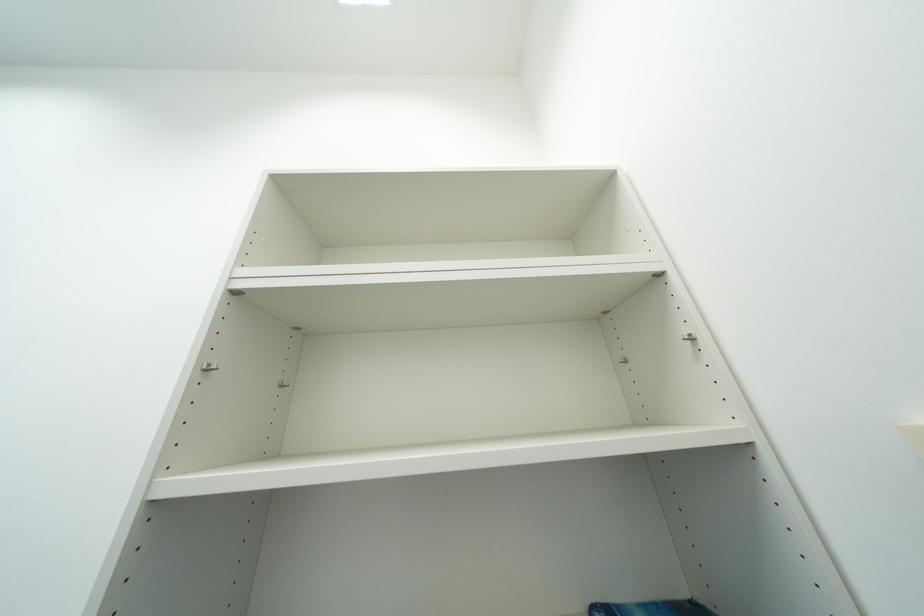
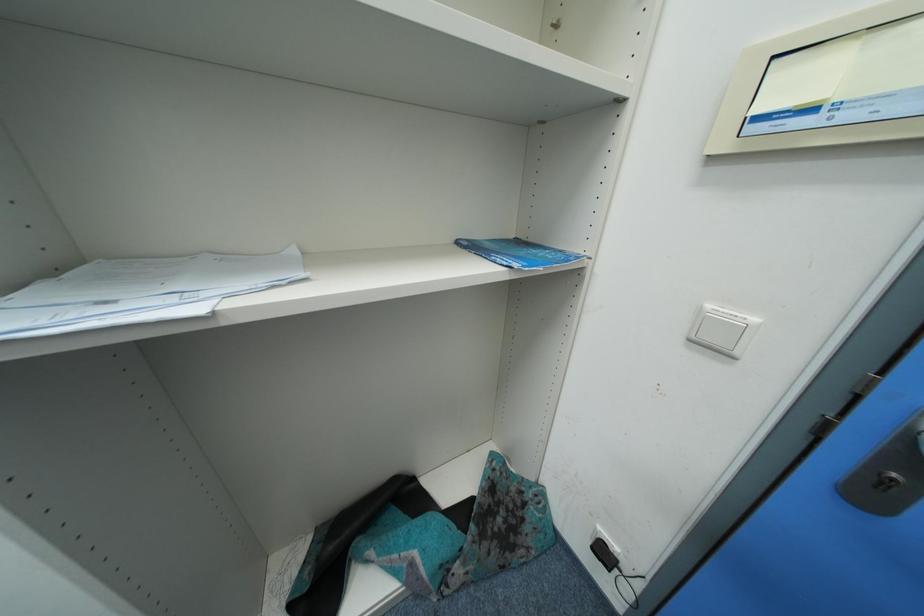
How did the camera likely rotate?

The camera's rotation is toward right-down.